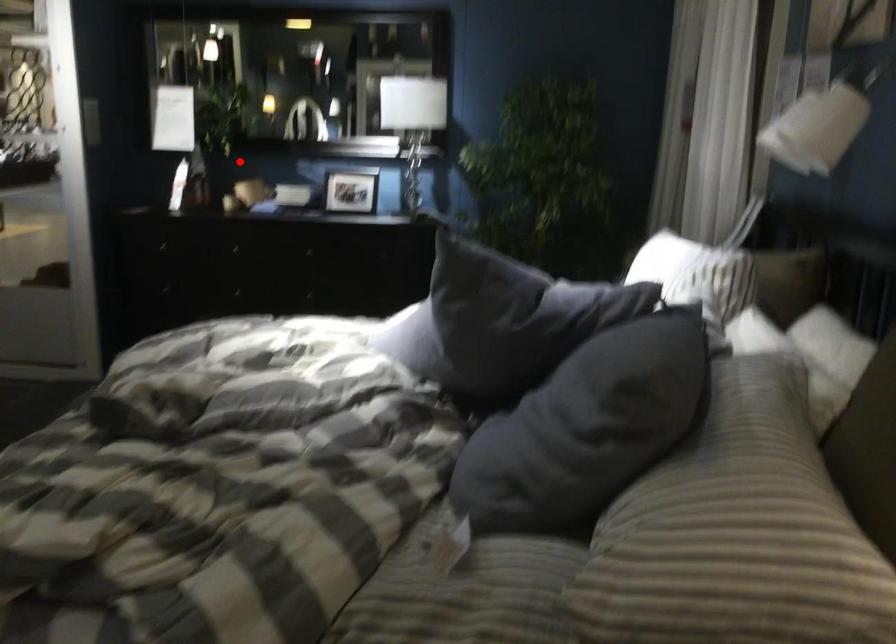
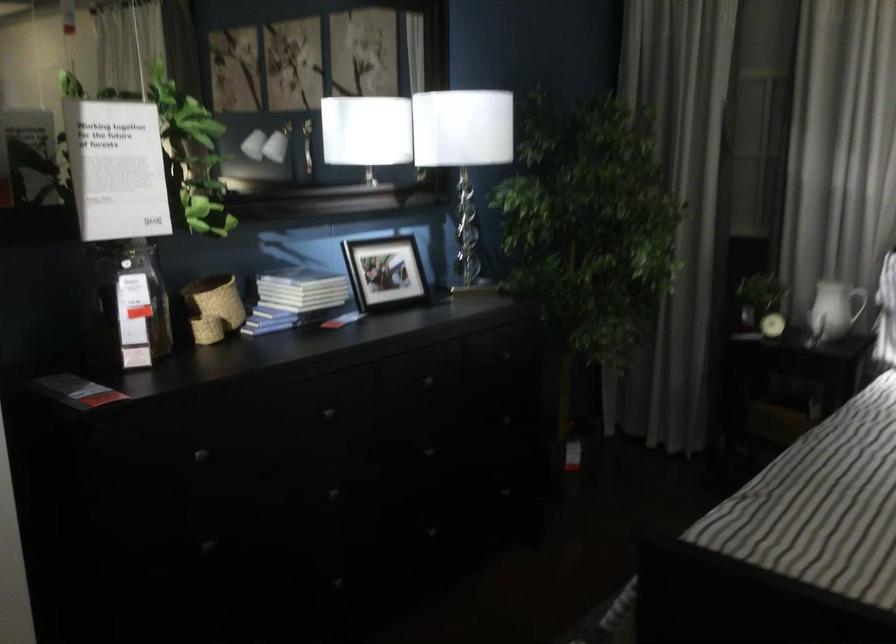
The point at the highlighted location is marked in the first image. Where is the corresponding point in the second image?

(213, 307)